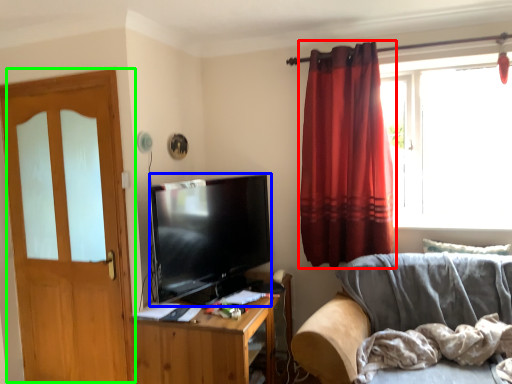
Question: Considering the real-world distances, which object is closest to curtain (highlighted by a red box)? television (highlighted by a blue box) or door (highlighted by a green box).

Choices:
 (A) television
 (B) door

Answer: (A)